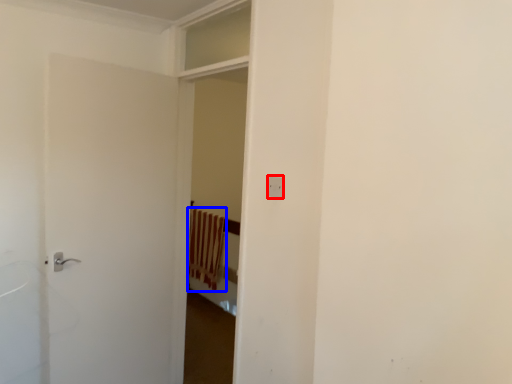
Question: Among these objects, which one is nearest to the camera, electric outlet (highlighted by a red box) or curtain (highlighted by a blue box)?

Choices:
 (A) electric outlet
 (B) curtain

Answer: (A)